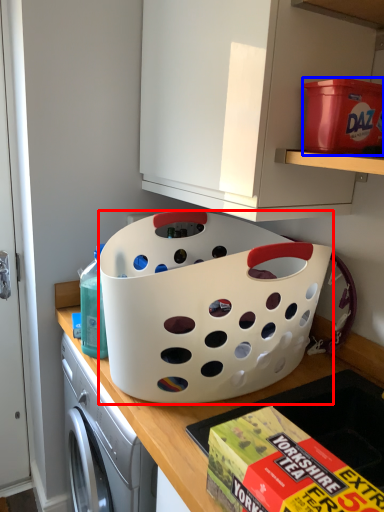
Question: Which point is closer to the camera, basket (highlighted by a red box) or storage box (highlighted by a blue box)?

Choices:
 (A) basket
 (B) storage box

Answer: (B)